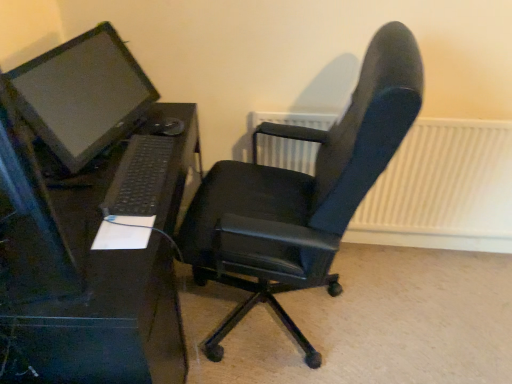
Locate an element on the screen. Image resolution: width=512 pixels, height=384 pixels. vacant space to the right of black leather office chair at center is located at coordinates (407, 319).